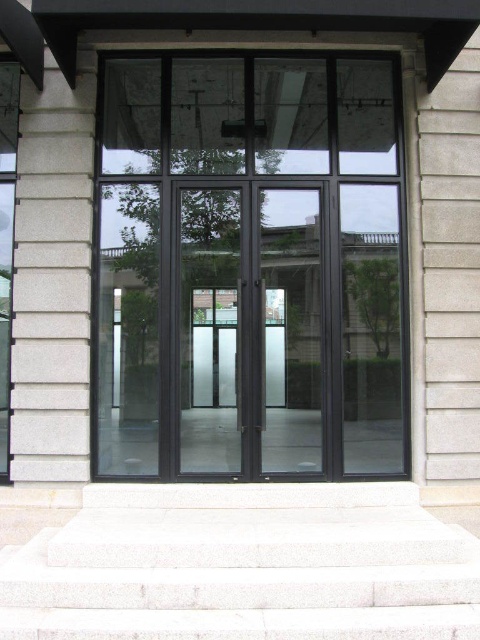
Question: Is black glass window at center positioned behind white stone stairs at center?

Choices:
 (A) yes
 (B) no

Answer: (A)

Question: Which of the following is the closest to the observer?

Choices:
 (A) (373, 140)
 (B) (335, 499)

Answer: (B)

Question: Does black glass window at center have a smaller size compared to white stone stairs at center?

Choices:
 (A) no
 (B) yes

Answer: (A)

Question: Which of the following is the closest to the observer?

Choices:
 (A) (477, 556)
 (B) (248, 212)

Answer: (A)

Question: Is black glass window at center below white stone stairs at center?

Choices:
 (A) no
 (B) yes

Answer: (A)